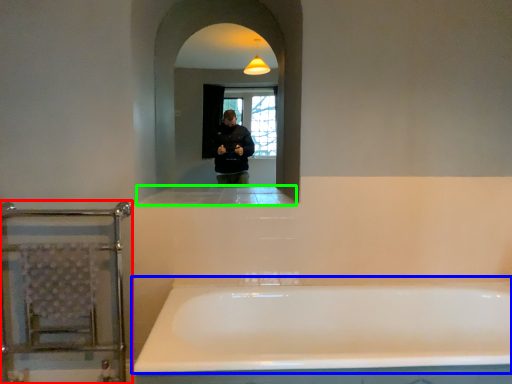
Question: Which object is positioned closest to balustrade (highlighted by a red box)? Select from bathtub (highlighted by a blue box) and ledge (highlighted by a green box).

Choices:
 (A) bathtub
 (B) ledge

Answer: (B)